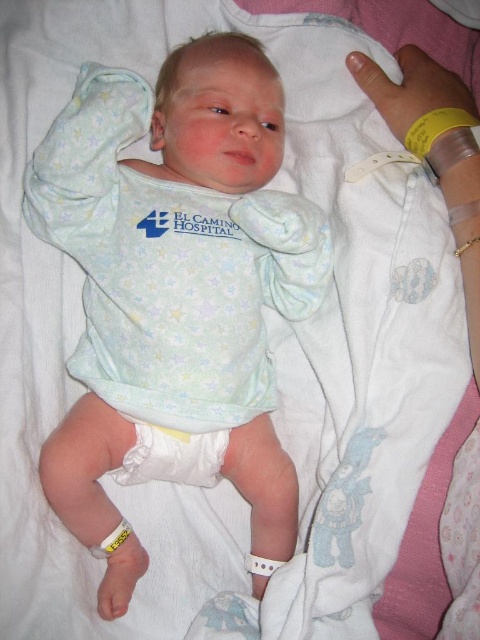
Does white soft fabric baby at center come in front of white soft diaper at center?

Yes, it is.

Between white soft fabric baby at center and white soft diaper at center, which one has less height?

white soft diaper at center

The width and height of the screenshot is (480, 640). What do you see at coordinates (176, 294) in the screenshot?
I see `white soft fabric baby at center` at bounding box center [176, 294].

The height and width of the screenshot is (640, 480). Identify the location of white soft fabric baby at center. (176, 294).